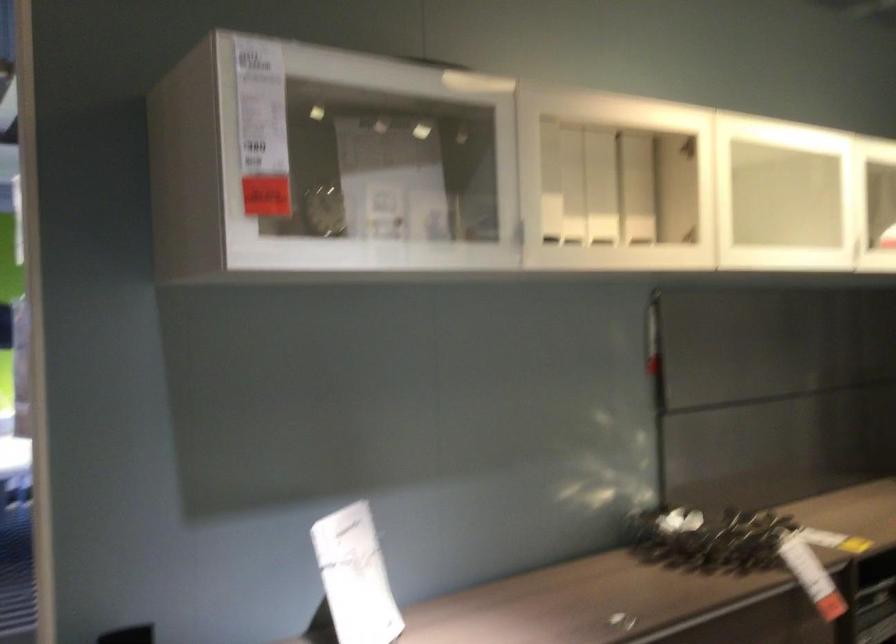
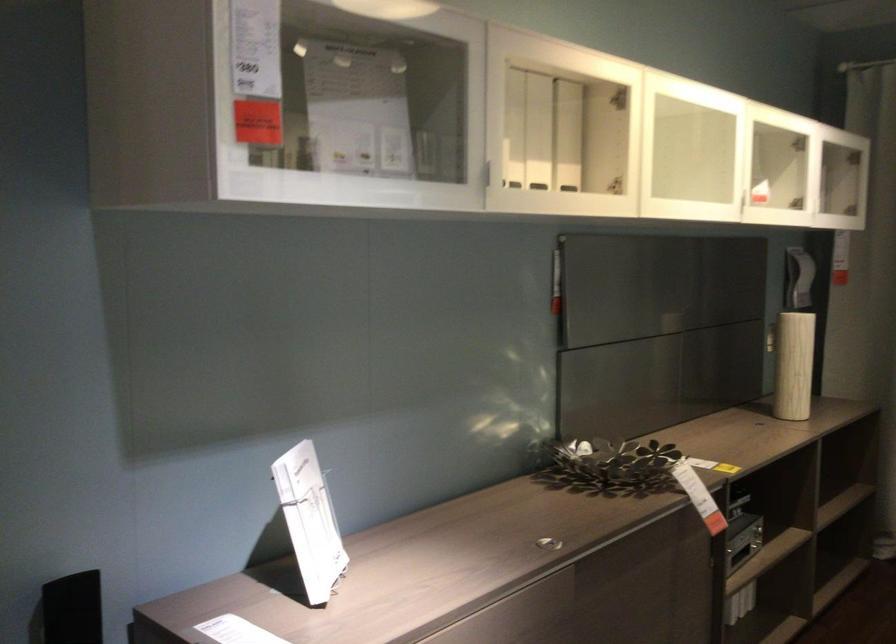
In the second image, find the point that corresponds to [512,234] in the first image.

(487, 174)